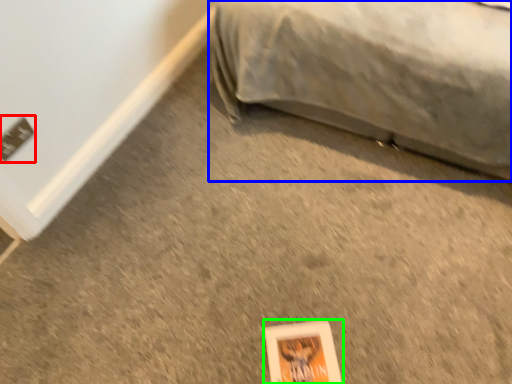
Question: Which object is the farthest from electric outlet (highlighted by a red box)? Choose among these: furniture (highlighted by a blue box) or paperback book (highlighted by a green box).

Choices:
 (A) furniture
 (B) paperback book

Answer: (A)